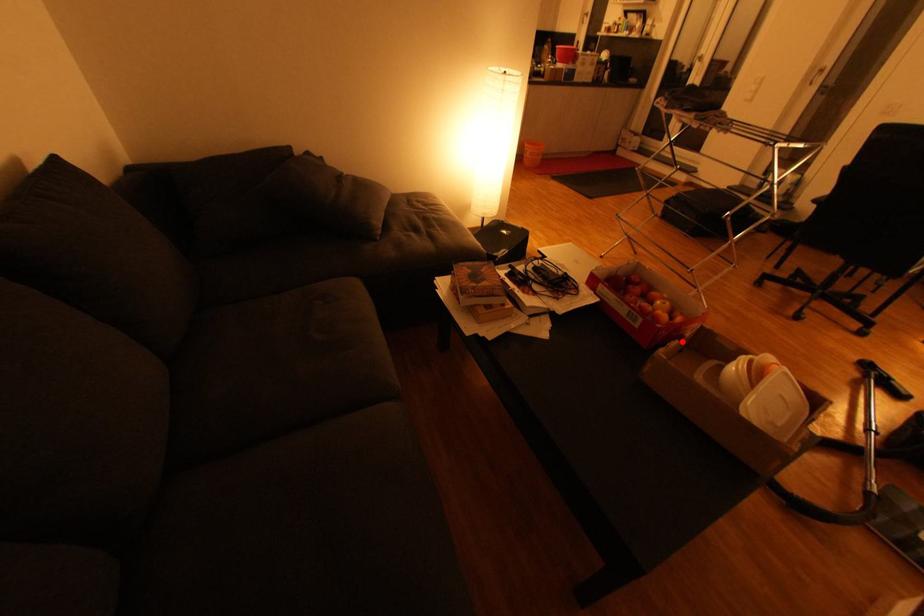
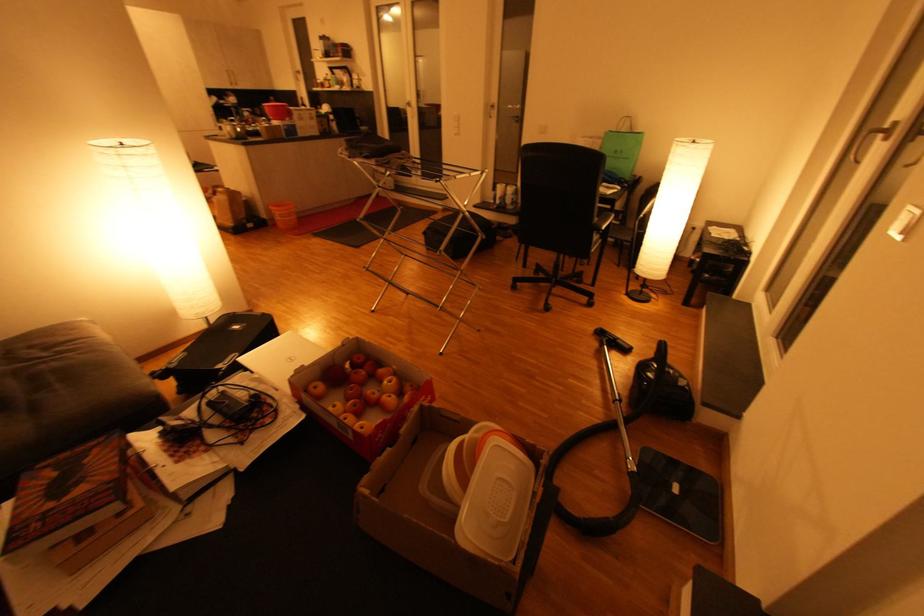
Question: I am providing you with two images of the same scene from different viewpoints. A red point is marked on the first image. At the location where the point appears in image 1, is it still visible in image 2?

Choices:
 (A) Yes
 (B) No

Answer: (A)